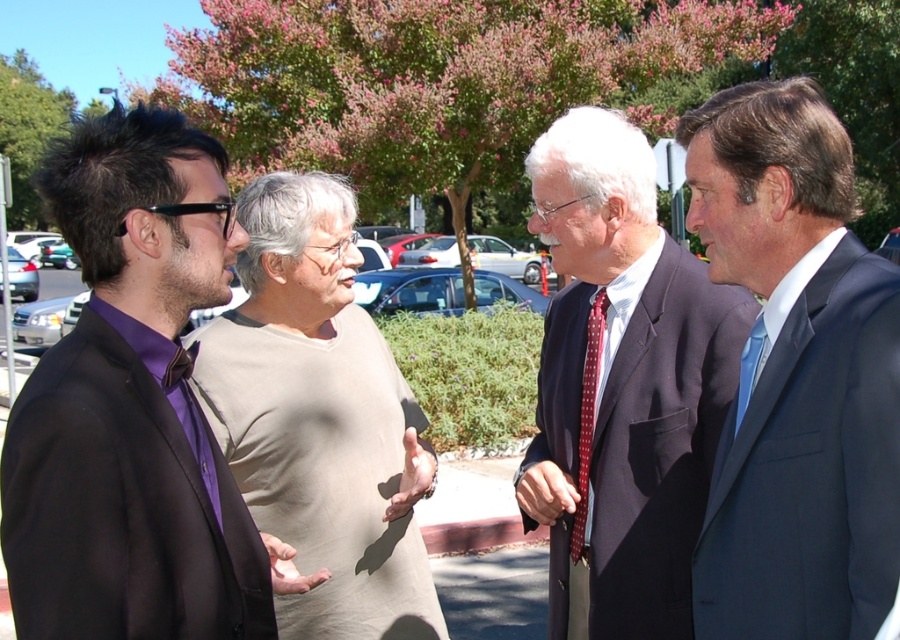
Who is positioned more to the right, purple satin bow tie at left or blue silk suit at right?

blue silk suit at right

Who is shorter, purple satin bow tie at left or blue silk suit at right?

Standing shorter between the two is purple satin bow tie at left.

Image resolution: width=900 pixels, height=640 pixels. I want to click on purple satin bow tie at left, so click(x=131, y=406).

What do you see at coordinates (795, 376) in the screenshot? This screenshot has height=640, width=900. I see `blue silk suit at right` at bounding box center [795, 376].

Is point (760, 577) farther from viewer compared to point (558, 268)?

No, (760, 577) is closer to viewer.

The image size is (900, 640). I want to click on blue silk suit at right, so click(795, 376).

Who is positioned more to the left, purple satin bow tie at left or light beige cotton shirt at center?

From the viewer's perspective, purple satin bow tie at left appears more on the left side.

Who is lower down, purple satin bow tie at left or light beige cotton shirt at center?

Positioned lower is light beige cotton shirt at center.

Between point (279, 556) and point (259, 205), which one is positioned behind?

The point (259, 205) is behind.

What are the coordinates of `purple satin bow tie at left` in the screenshot? It's located at (131, 406).